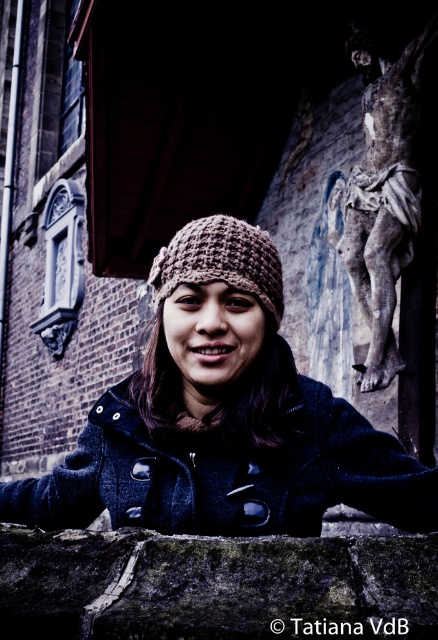
Question: Based on their relative distances, which object is nearer to the weathered stone crucifix at right?

Choices:
 (A) knitted brown hat at center
 (B) brown knitted beanie at center

Answer: (A)

Question: Can you confirm if brown knitted beanie at center is thinner than knitted brown hat at center?

Choices:
 (A) no
 (B) yes

Answer: (A)

Question: Is brown knitted beanie at center thinner than weathered stone crucifix at right?

Choices:
 (A) yes
 (B) no

Answer: (B)

Question: Which point appears farthest from the camera in this image?

Choices:
 (A) (339, 486)
 (B) (230, 269)

Answer: (B)

Question: Which of the following is the farthest from the observer?

Choices:
 (A) weathered stone crucifix at right
 (B) brown knitted beanie at center

Answer: (A)

Question: Does brown knitted beanie at center have a smaller size compared to knitted brown hat at center?

Choices:
 (A) yes
 (B) no

Answer: (B)